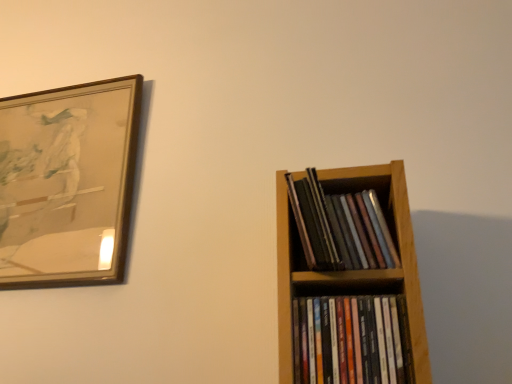
Question: Can you confirm if matte black books at right, which ranks as the first book in top-to-bottom order, is thinner than wooden picture frame at upper left?

Choices:
 (A) yes
 (B) no

Answer: (B)

Question: Is matte black books at right, marked as the 2th book in a bottom-to-top arrangement, positioned before wooden picture frame at upper left?

Choices:
 (A) yes
 (B) no

Answer: (A)

Question: Can you confirm if matte black books at right, which ranks as the first book in top-to-bottom order, is bigger than wooden picture frame at upper left?

Choices:
 (A) no
 (B) yes

Answer: (A)

Question: Considering the relative sizes of matte black books at right, which ranks as the first book in top-to-bottom order, and wooden picture frame at upper left in the image provided, is matte black books at right, which ranks as the first book in top-to-bottom order, smaller than wooden picture frame at upper left?

Choices:
 (A) no
 (B) yes

Answer: (B)

Question: Considering the relative sizes of matte black books at right, which ranks as the first book in top-to-bottom order, and wooden picture frame at upper left in the image provided, is matte black books at right, which ranks as the first book in top-to-bottom order, taller than wooden picture frame at upper left?

Choices:
 (A) no
 (B) yes

Answer: (A)

Question: Considering the relative sizes of matte black books at right, which ranks as the first book in top-to-bottom order, and wooden picture frame at upper left in the image provided, is matte black books at right, which ranks as the first book in top-to-bottom order, wider than wooden picture frame at upper left?

Choices:
 (A) yes
 (B) no

Answer: (A)

Question: Can you confirm if wooden picture frame at upper left is smaller than multicolored glossy cd cases at right, which appears as the first book when ordered from the bottom?

Choices:
 (A) no
 (B) yes

Answer: (A)

Question: Can we say wooden picture frame at upper left lies outside multicolored glossy cd cases at right, the second book in the top-to-bottom sequence?

Choices:
 (A) yes
 (B) no

Answer: (A)

Question: Is wooden picture frame at upper left in contact with multicolored glossy cd cases at right, the second book in the top-to-bottom sequence?

Choices:
 (A) yes
 (B) no

Answer: (B)

Question: Considering the relative sizes of wooden picture frame at upper left and multicolored glossy cd cases at right, the second book in the top-to-bottom sequence, in the image provided, is wooden picture frame at upper left taller than multicolored glossy cd cases at right, the second book in the top-to-bottom sequence,?

Choices:
 (A) yes
 (B) no

Answer: (A)

Question: Considering the relative positions of wooden picture frame at upper left and multicolored glossy cd cases at right, which appears as the first book when ordered from the bottom, in the image provided, is wooden picture frame at upper left in front of multicolored glossy cd cases at right, which appears as the first book when ordered from the bottom,?

Choices:
 (A) no
 (B) yes

Answer: (A)

Question: Is wooden picture frame at upper left to the left of multicolored glossy cd cases at right, which appears as the first book when ordered from the bottom, from the viewer's perspective?

Choices:
 (A) yes
 (B) no

Answer: (A)

Question: Is wooden picture frame at upper left shorter than matte black books at right, which ranks as the first book in top-to-bottom order?

Choices:
 (A) yes
 (B) no

Answer: (B)